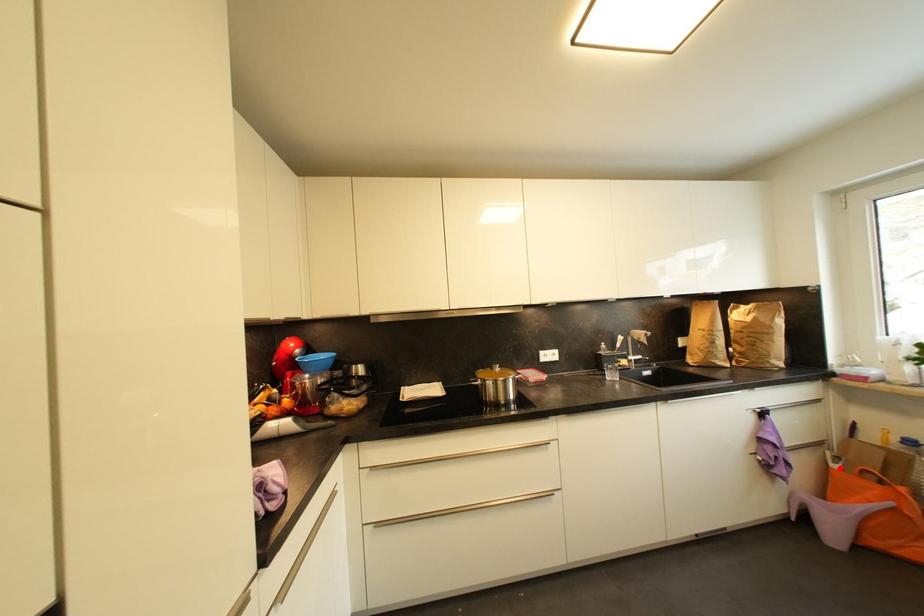
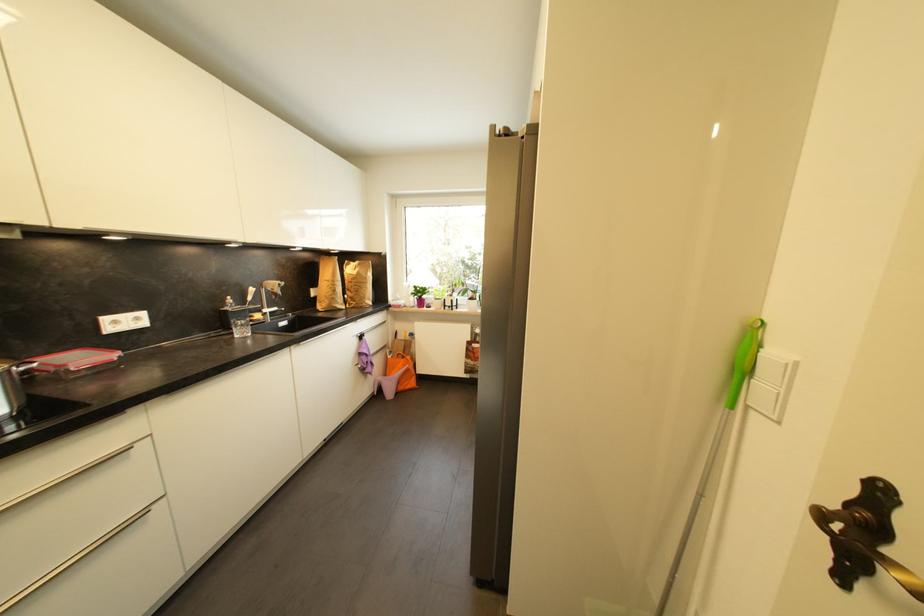
Question: I am providing you with two images of the same scene from different viewpoints. In image1, a red point is highlighted. Considering the same 3D point in image2, which of the following is correct?

Choices:
 (A) It is closer
 (B) It is farther

Answer: (B)